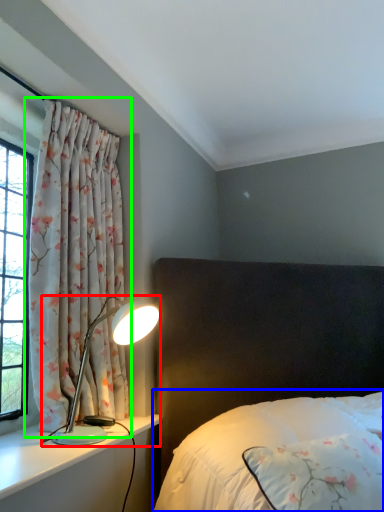
Question: Based on their relative distances, which object is farther from lamp (highlighted by a red box)? Choose from bed (highlighted by a blue box) and curtain (highlighted by a green box).

Choices:
 (A) bed
 (B) curtain

Answer: (A)